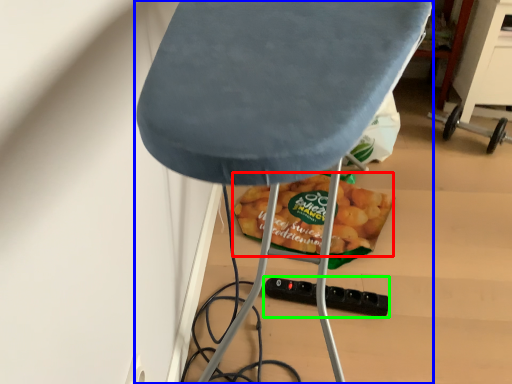
Question: Based on their relative distances, which object is nearer to snack (highlighted by a red box)? Choose from furniture (highlighted by a blue box) and socket (highlighted by a green box).

Choices:
 (A) furniture
 (B) socket

Answer: (B)